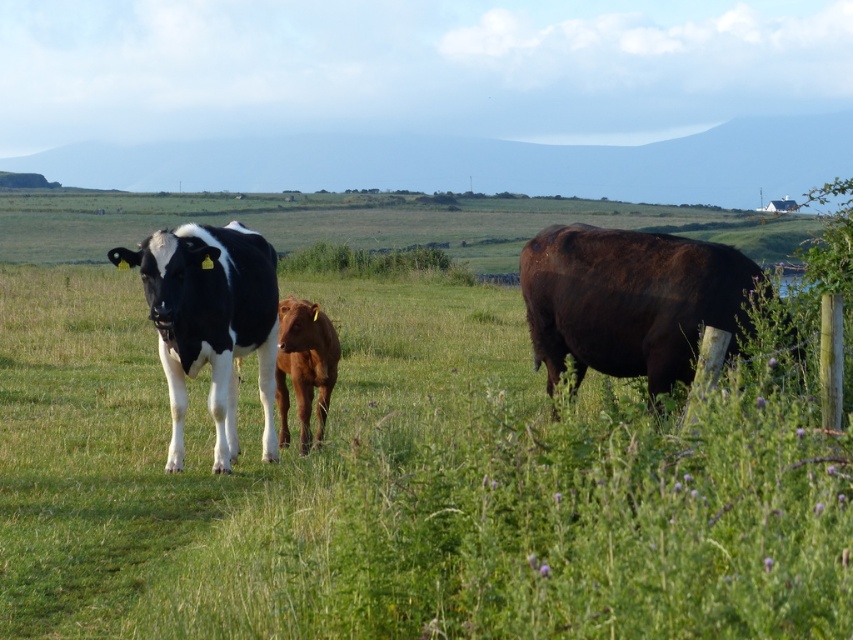
Is shiny dark brown bull at right taller than brown smooth calf at center?

Yes.

Can you confirm if shiny dark brown bull at right is wider than brown smooth calf at center?

Correct, the width of shiny dark brown bull at right exceeds that of brown smooth calf at center.

Is point (601, 253) positioned behind point (302, 365)?

No.

Where is `shiny dark brown bull at right`? The height and width of the screenshot is (640, 853). shiny dark brown bull at right is located at coordinates (630, 301).

Can you confirm if green grass at center is taller than brown smooth calf at center?

Yes, green grass at center is taller than brown smooth calf at center.

Does green grass at center have a greater width compared to brown smooth calf at center?

Yes, green grass at center is wider than brown smooth calf at center.

Which is behind, point (364, 468) or point (309, 314)?

Positioned behind is point (309, 314).

Where is `green grass at center`? green grass at center is located at coordinates (399, 486).

Can you confirm if black and white cow at left is positioned to the right of brown smooth calf at center?

No, black and white cow at left is not to the right of brown smooth calf at center.

Is black and white cow at left behind brown smooth calf at center?

No, black and white cow at left is closer to the viewer.

This screenshot has height=640, width=853. What do you see at coordinates (210, 321) in the screenshot?
I see `black and white cow at left` at bounding box center [210, 321].

Locate an element on the screen. The width and height of the screenshot is (853, 640). black and white cow at left is located at coordinates (210, 321).